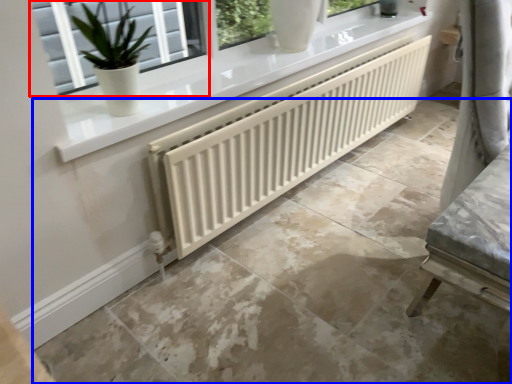
Question: Which object appears closest to the camera in this image, window (highlighted by a red box) or concrete (highlighted by a blue box)?

Choices:
 (A) window
 (B) concrete

Answer: (B)